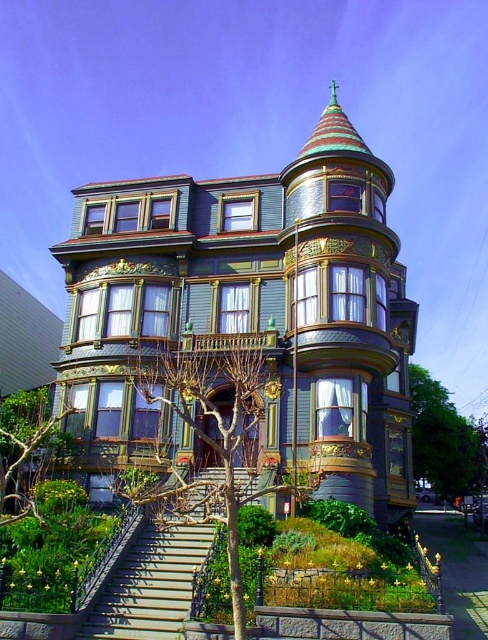
You are standing at the base of the stairs leading to the Victorian house. You notice a point marked at coordinates [207,433] in the image. What is located at that point?

The point at coordinates [207,433] indicates bare branches at center.

You are standing at the bottom of the stairs leading to the Victorian house and notice two trees in the garden. The bare branches at center and the green leafy tree at lower left. Which one appears larger in size?

The bare branches at center appears larger in size than the green leafy tree at lower left.

You are standing in the garden of the Victorian house and see the bare branches at center and the green leafy tree at lower left. Which tree is closer to the main entrance of the house?

The green leafy tree at lower left is closer to the main entrance because the bare branches at center is positioned on the right side of it, implying the green leafy tree is between the entrance and the bare branches.